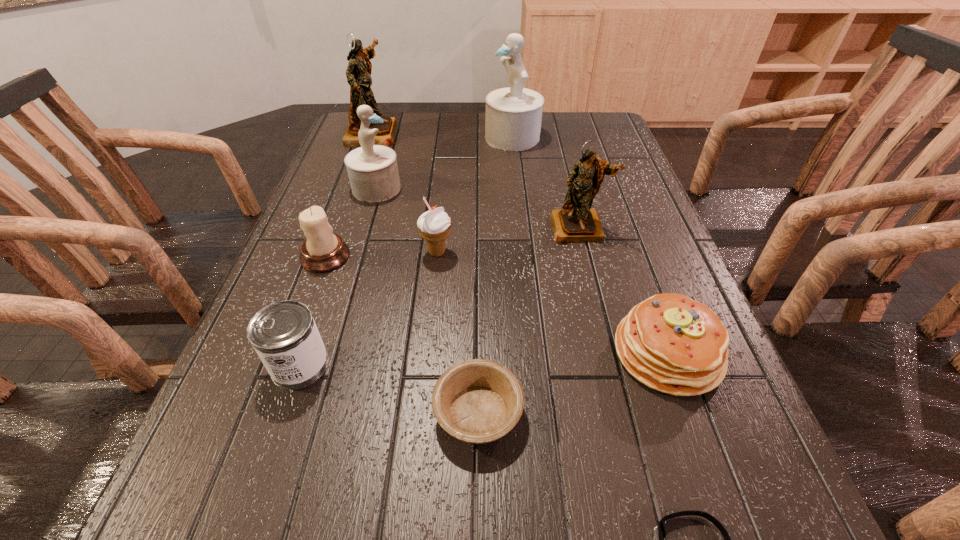
Identify the location of vacant region located 0.120m on the back of the white candle holder. (343, 210).

Find the location of a particular element. vacant area situated on the left of the icecream is located at coordinates (287, 252).

You are a GUI agent. You are given a task and a screenshot of the screen. Output one action in this format:
    pyautogui.click(x=<x>, y=<y>)
    Task: Click on the vacant space located on the back of the can
    The image size is (960, 540).
    Given the screenshot: What is the action you would take?
    pyautogui.click(x=337, y=255)

Locate an element on the screen. The width and height of the screenshot is (960, 540). free space located on the back of the third shortest object is located at coordinates (614, 204).

Locate an element on the screen. vacant space located on the right of the second shortest object is located at coordinates (565, 412).

In order to click on candle holder at the left edge in this screenshot , I will do `click(322, 251)`.

You are a GUI agent. You are given a task and a screenshot of the screen. Output one action in this format:
    pyautogui.click(x=<x>, y=<y>)
    Task: Click on the can that is at the left edge
    This screenshot has height=540, width=960.
    Given the screenshot: What is the action you would take?
    pyautogui.click(x=284, y=334)

Where is `figurine that is at the right edge`? The width and height of the screenshot is (960, 540). figurine that is at the right edge is located at coordinates coord(576,222).

Locate an element on the screen. Image resolution: width=960 pixels, height=540 pixels. pancake that is at the right edge is located at coordinates (669, 342).

At what (x,y) coordinates should I click in order to perform the action: click on object situated at the far left corner. Please return your answer as a coordinate pair (x, y). This screenshot has height=540, width=960. Looking at the image, I should click on (358, 73).